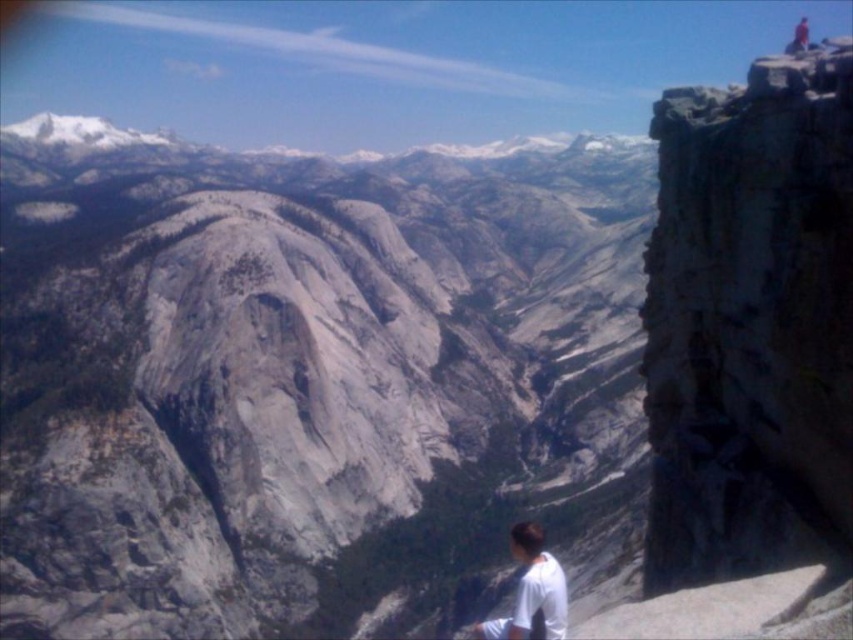
You are a hiker who wants to take a photo of the gray rock formation at center and the white matte shirt at lower right in the same frame. Based on their sizes in the image, which one will appear larger in the photo?

The gray rock formation at center will appear larger in the photo because it is taller than the white matte shirt at lower right.

You are a hiker who wants to take a photo of the gray rock formation at center and the white matte shirt at lower right. Which object should you focus on first if you want to capture both in one frame without moving the camera?

The gray rock formation at center is larger than the white matte shirt at lower right, so you should focus on the gray rock formation at center first to ensure it fills the frame appropriately before adjusting for the smaller white matte shirt at lower right.